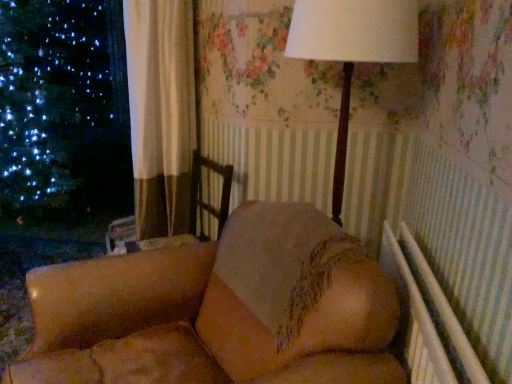
Question: Is velvet beige sofa at center looking in the opposite direction of matte brown lamp at upper center?

Choices:
 (A) no
 (B) yes

Answer: (A)

Question: Can you confirm if velvet beige sofa at center is taller than matte brown lamp at upper center?

Choices:
 (A) no
 (B) yes

Answer: (A)

Question: Considering the relative positions of velvet beige sofa at center and matte brown lamp at upper center in the image provided, is velvet beige sofa at center to the right of matte brown lamp at upper center from the viewer's perspective?

Choices:
 (A) yes
 (B) no

Answer: (B)

Question: From the image's perspective, would you say velvet beige sofa at center is positioned over matte brown lamp at upper center?

Choices:
 (A) yes
 (B) no

Answer: (B)

Question: Could you tell me if velvet beige sofa at center is facing matte brown lamp at upper center?

Choices:
 (A) no
 (B) yes

Answer: (A)

Question: Considering the relative sizes of velvet beige sofa at center and matte brown lamp at upper center in the image provided, is velvet beige sofa at center thinner than matte brown lamp at upper center?

Choices:
 (A) yes
 (B) no

Answer: (B)

Question: From a real-world perspective, is matte brown lamp at upper center on top of velvet beige sofa at center?

Choices:
 (A) yes
 (B) no

Answer: (A)

Question: Are matte brown lamp at upper center and velvet beige sofa at center located far from each other?

Choices:
 (A) yes
 (B) no

Answer: (B)

Question: Is matte brown lamp at upper center taller than velvet beige sofa at center?

Choices:
 (A) yes
 (B) no

Answer: (A)

Question: Is matte brown lamp at upper center facing towards velvet beige sofa at center?

Choices:
 (A) yes
 (B) no

Answer: (A)

Question: Does matte brown lamp at upper center have a lesser height compared to velvet beige sofa at center?

Choices:
 (A) yes
 (B) no

Answer: (B)

Question: Is matte brown lamp at upper center bigger than velvet beige sofa at center?

Choices:
 (A) no
 (B) yes

Answer: (A)

Question: From the image's perspective, is matte brown lamp at upper center located above or below velvet beige sofa at center?

Choices:
 (A) above
 (B) below

Answer: (A)